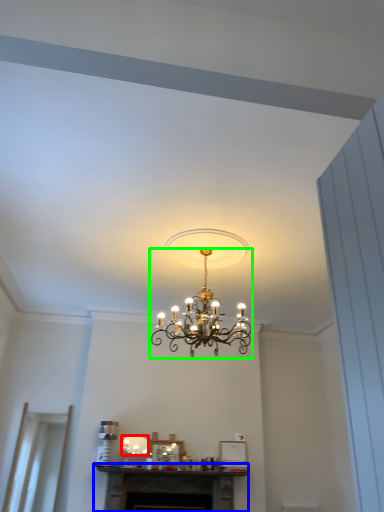
Question: Which is farther away from lamp (highlighted by a red box)? fireplace (highlighted by a blue box) or lamp (highlighted by a green box)?

Choices:
 (A) fireplace
 (B) lamp

Answer: (B)